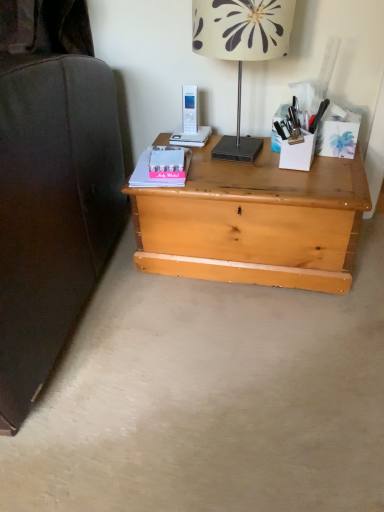
Where is `free location to the right of matte pink paperback book at center, the second paperback book from the back`? free location to the right of matte pink paperback book at center, the second paperback book from the back is located at coordinates (230, 176).